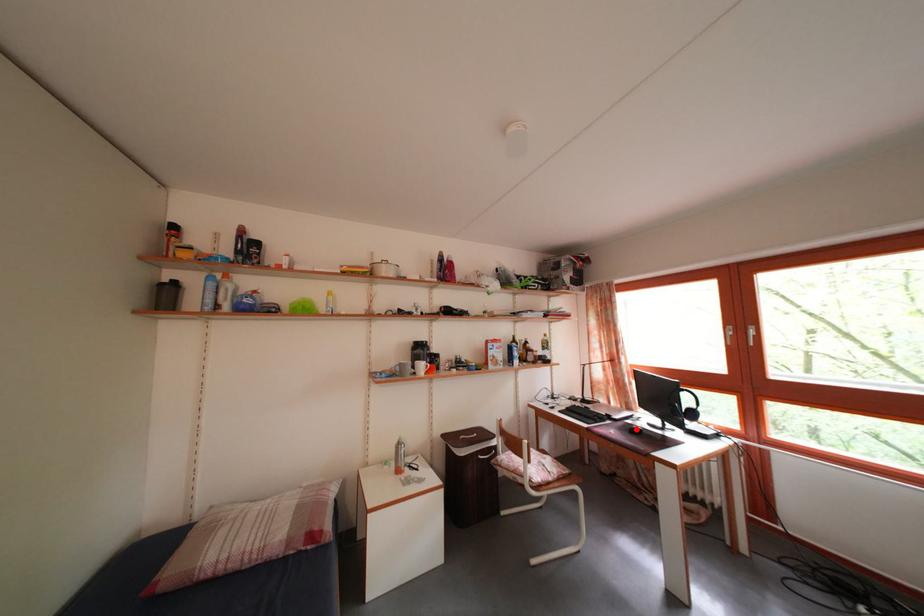
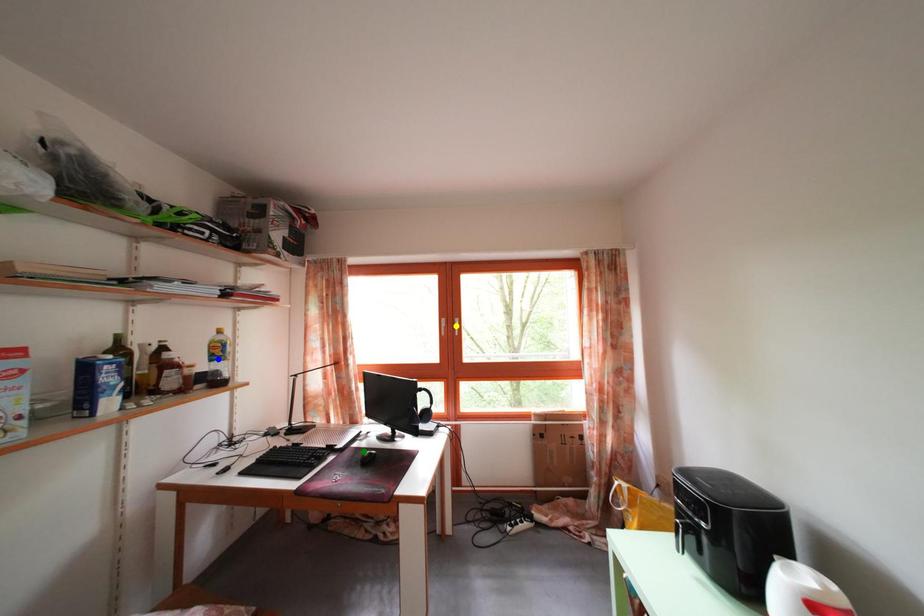
Question: I am providing you with two images of the same scene from different viewpoints. A red point is marked on the first image. You are given multiple points on the second image. Can you choose the point in image 2 that corresponds to the point in image 1?

Choices:
 (A) blue point
 (B) green point
 (C) yellow point

Answer: (B)